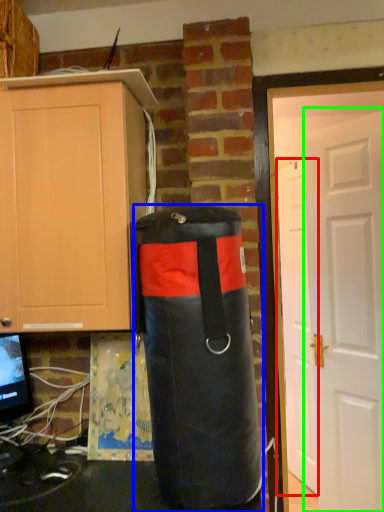
Question: Based on their relative distances, which object is nearer to door (highlighted by a red box)? Choose from punching bag (highlighted by a blue box) and door (highlighted by a green box).

Choices:
 (A) punching bag
 (B) door

Answer: (B)